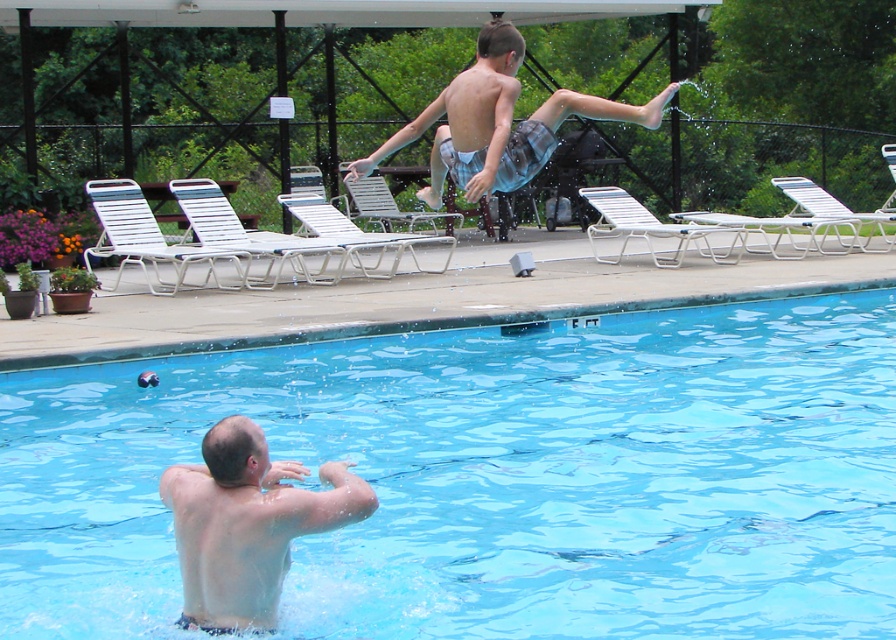
Between pale skin at upper center and light blue plaid shorts at upper center, which one has more height?

light blue plaid shorts at upper center

This screenshot has width=896, height=640. What do you see at coordinates (247, 524) in the screenshot?
I see `pale skin at upper center` at bounding box center [247, 524].

This screenshot has width=896, height=640. Identify the location of pale skin at upper center. (247, 524).

Is transparent blue water at center to the left of pale skin at upper center from the viewer's perspective?

Incorrect, transparent blue water at center is not on the left side of pale skin at upper center.

The image size is (896, 640). What do you see at coordinates (493, 477) in the screenshot? I see `transparent blue water at center` at bounding box center [493, 477].

Locate an element on the screen. Image resolution: width=896 pixels, height=640 pixels. transparent blue water at center is located at coordinates (493, 477).

You are a GUI agent. You are given a task and a screenshot of the screen. Output one action in this format:
    pyautogui.click(x=<x>, y=<y>)
    Task: Click on the transparent blue water at center
    
    Given the screenshot: What is the action you would take?
    tap(493, 477)

Describe the element at coordinates (493, 477) in the screenshot. I see `transparent blue water at center` at that location.

Is point (722, 620) closer to viewer compared to point (479, 156)?

That is True.

Identify the location of transparent blue water at center. (493, 477).